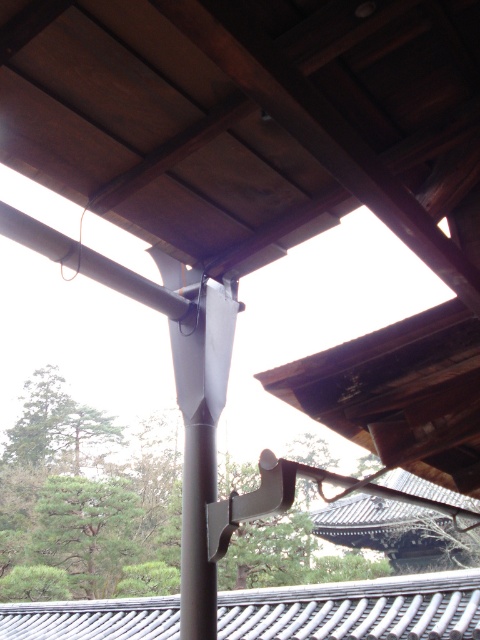
Consider the image. You are an architect analyzing the structural integrity of the building. You notice the dark brown wood at center and the gray tile roof at lower center. Which object is located to the left of the other?

The dark brown wood at center is positioned on the left side of gray tile roof at lower center.

You are an architect assessing the structural integrity of the building. You notice the dark brown wood at center and the gray tile roof at lower center. Which of these two elements has a narrower width?

The dark brown wood at center has a lesser width compared to the gray tile roof at lower center, so it is narrower.